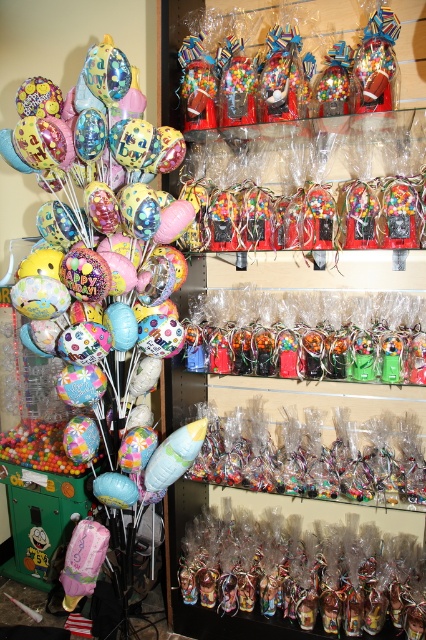
You are organizing a birthday party and need to choose decorations. You have two options from the store display shown in the image. The first option is the matte pastel balloons at left, and the second is the translucent plastic figurines at center. Which of these two items takes up more space in the store shelf?

The matte pastel balloons at left is bigger than the translucent plastic figurines at center, so the matte pastel balloons at left takes up more space in the store shelf.

You are a customer looking to buy decorations for a baby shower. You see the matte pastel balloons at left and the translucent plastic figurines at center. Which item is positioned higher in the display?

The matte pastel balloons at left are positioned higher than the translucent plastic figurines at center.

You are organizing a birthday party and need to decide where to place a new decoration. You have two options in the image provided. The first option is the matte pastel balloons at left, and the second is the translucent plastic figurines at center. Based on their heights, which decoration should you choose if you want something that will reach higher on your party wall?

The matte pastel balloons at left are taller than the translucent plastic figurines at center, so you should choose the matte pastel balloons at left if you want a decoration that reaches higher on the party wall.